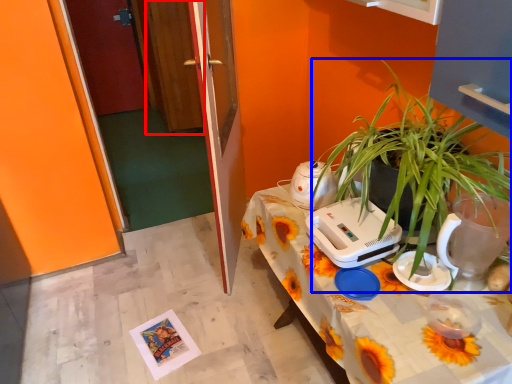
Question: Among these objects, which one is farthest to the camera, glass door (highlighted by a red box) or houseplant (highlighted by a blue box)?

Choices:
 (A) glass door
 (B) houseplant

Answer: (A)